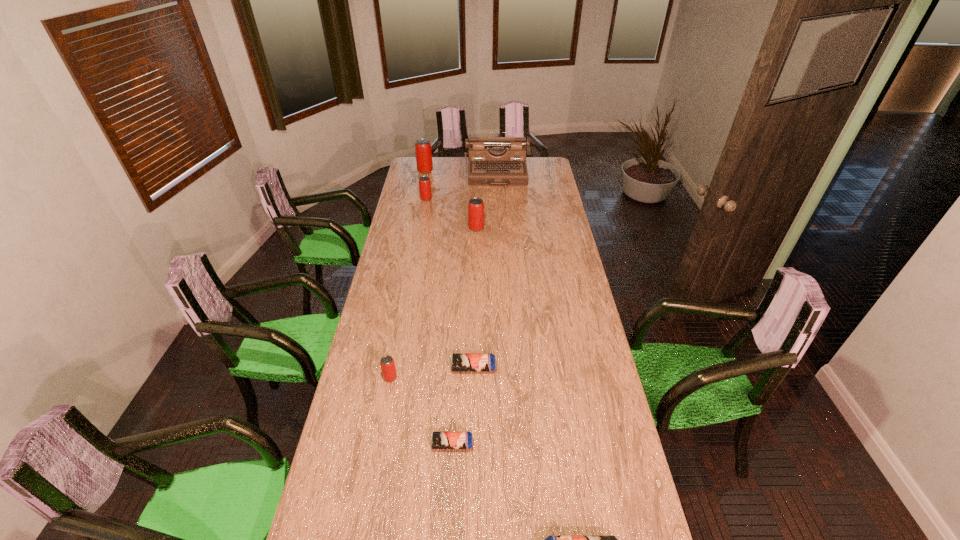
The height and width of the screenshot is (540, 960). Identify the location of free spot between the smallest pink beer can and the third biggest pink beer can. (408, 288).

Locate an element on the screen. free space that is in between the shortest object and the second nearest pink beer can is located at coordinates (465, 336).

Find the location of a particular element. empty space that is in between the sixth tallest beer can and the brown typewriter is located at coordinates (485, 271).

The height and width of the screenshot is (540, 960). Identify the location of empty location between the second farthest pink beer can and the second smallest blue beer can. pos(449,284).

Where is `vacant region between the second shortest object and the fourth shortest beer can`? This screenshot has height=540, width=960. vacant region between the second shortest object and the fourth shortest beer can is located at coordinates (432, 373).

Where is `vacant point located between the farthest beer can and the nearest pink beer can`? vacant point located between the farthest beer can and the nearest pink beer can is located at coordinates (408, 274).

The image size is (960, 540). Identify the location of vacant space that's between the farthest beer can and the second biggest pink beer can. (451, 199).

At what (x,y) coordinates should I click in order to perform the action: click on the third closest object to the sixth shortest object. Please return your answer as a coordinate pair (x, y). Looking at the image, I should click on (423, 151).

This screenshot has height=540, width=960. In order to click on object identified as the sixth closest to the nearest pink beer can in this screenshot , I will do `click(493, 161)`.

The height and width of the screenshot is (540, 960). What are the coordinates of `beer can that is the fifth closest to the second shortest object` in the screenshot? It's located at (424, 182).